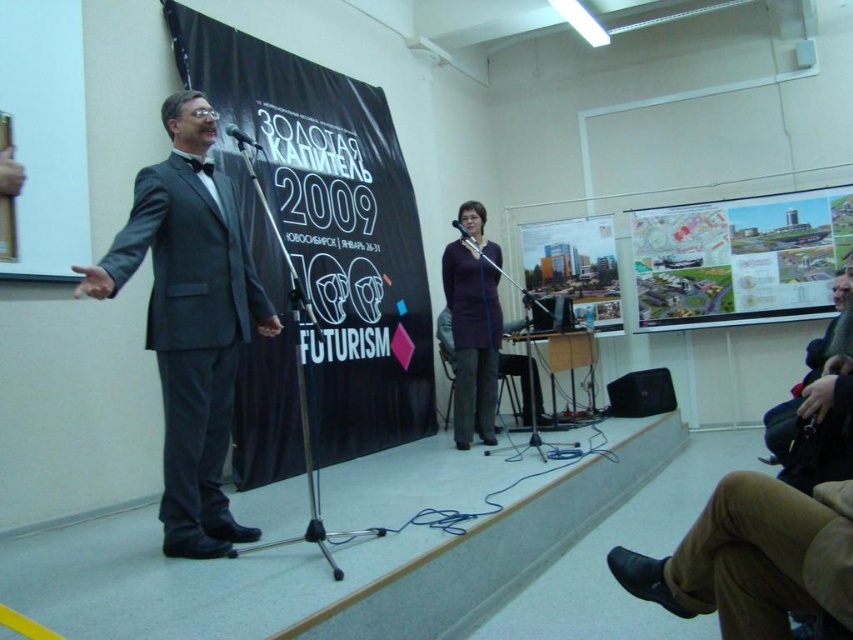
Measure the distance between matte gray suit at left and matte paper map at upper right.

matte gray suit at left is 4.79 meters away from matte paper map at upper right.

Identify the location of matte gray suit at left. [190, 320].

Looking at this image, which of these two, matte paper map at upper right or matte black microphone at center, stands shorter?

matte black microphone at center

Is matte paper map at upper right positioned before matte black microphone at center?

That is False.

Describe the element at coordinates (740, 256) in the screenshot. I see `matte paper map at upper right` at that location.

Image resolution: width=853 pixels, height=640 pixels. I want to click on matte paper map at upper right, so click(740, 256).

Between point (461, 225) and point (250, 140), which one is positioned in front?

Point (250, 140) is in front.

Is purple fabric dress at center further to camera compared to metallic silver microphone at center?

Yes.

Does point (473, 404) lie in front of point (245, 140)?

That is False.

At what (x,y) coordinates should I click in order to perform the action: click on purple fabric dress at center. Please return your answer as a coordinate pair (x, y). Looking at the image, I should click on (473, 326).